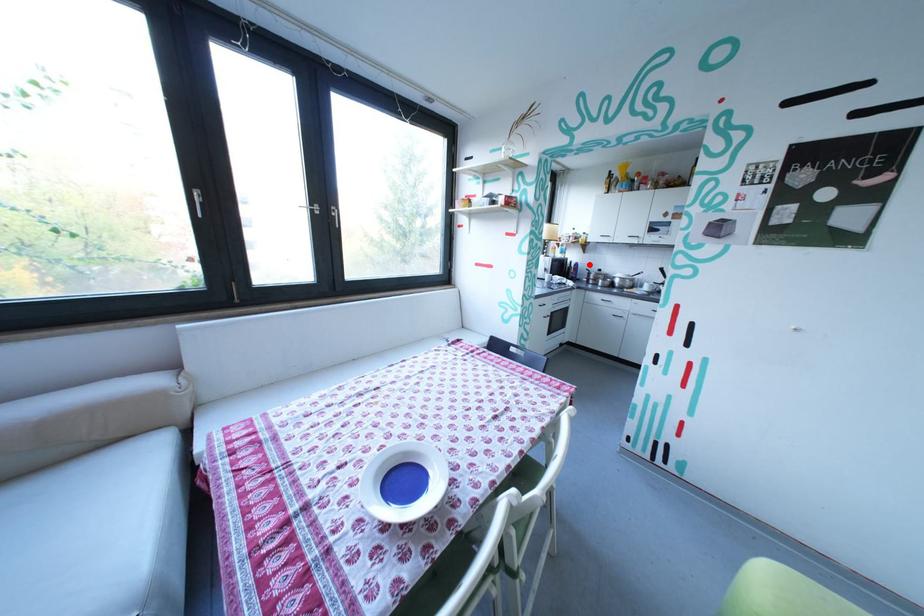
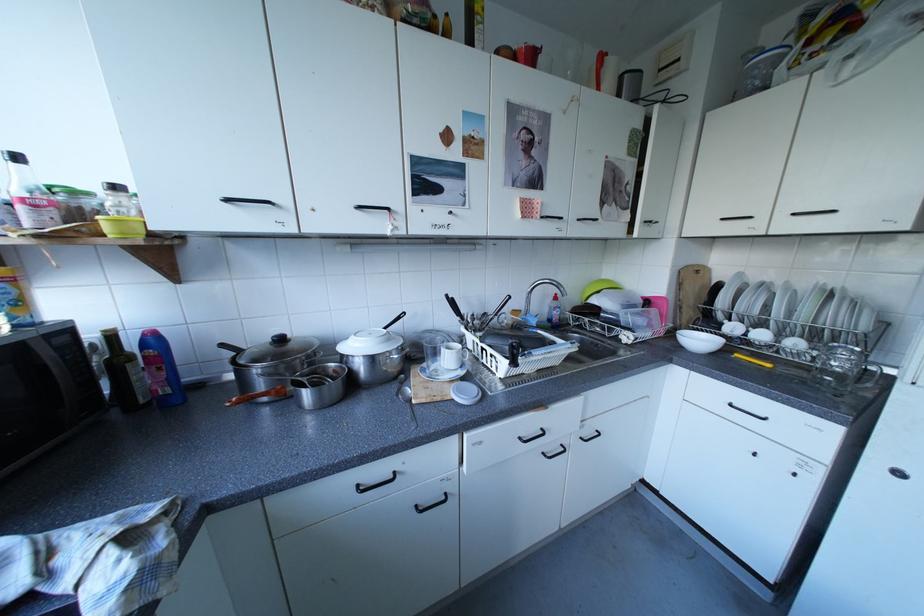
Question: I am providing you with two images of the same scene from different viewpoints. A red point is shown in image1. For the corresponding object point in image2, is it positioned nearer or farther from the camera?

Choices:
 (A) Nearer
 (B) Farther

Answer: (B)